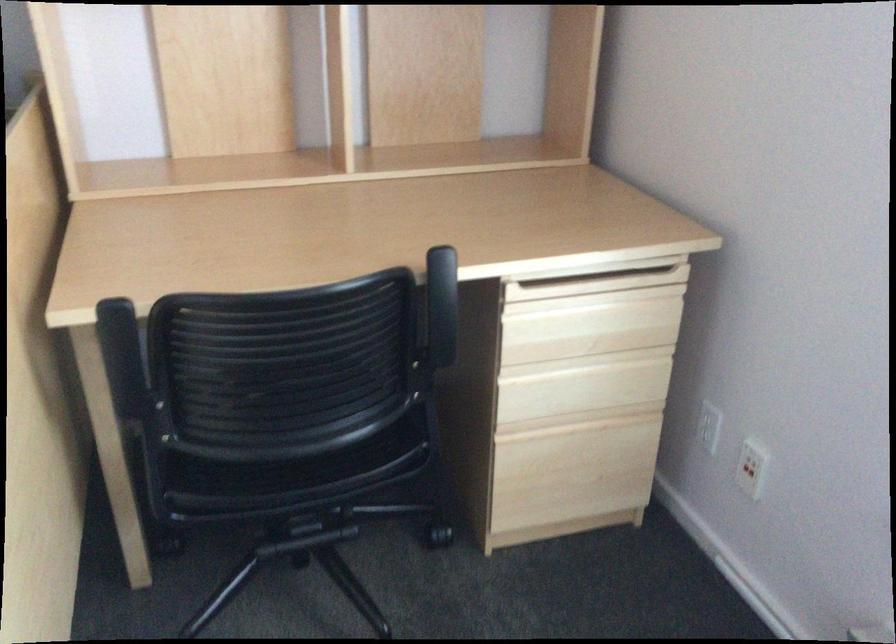
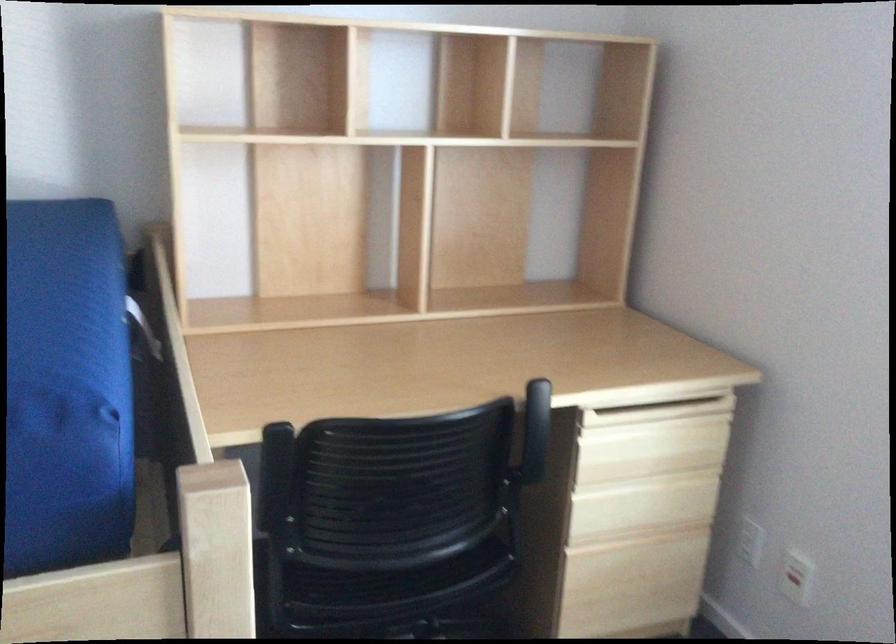
In a continuous first-person perspective shot, in which direction is the camera moving?

The movement direction of the cameraman is left, backward.